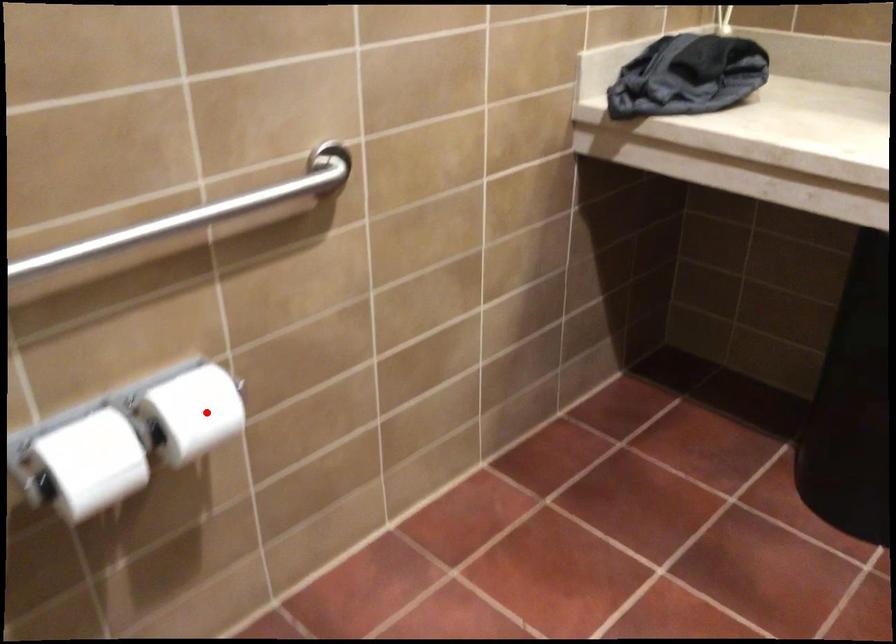
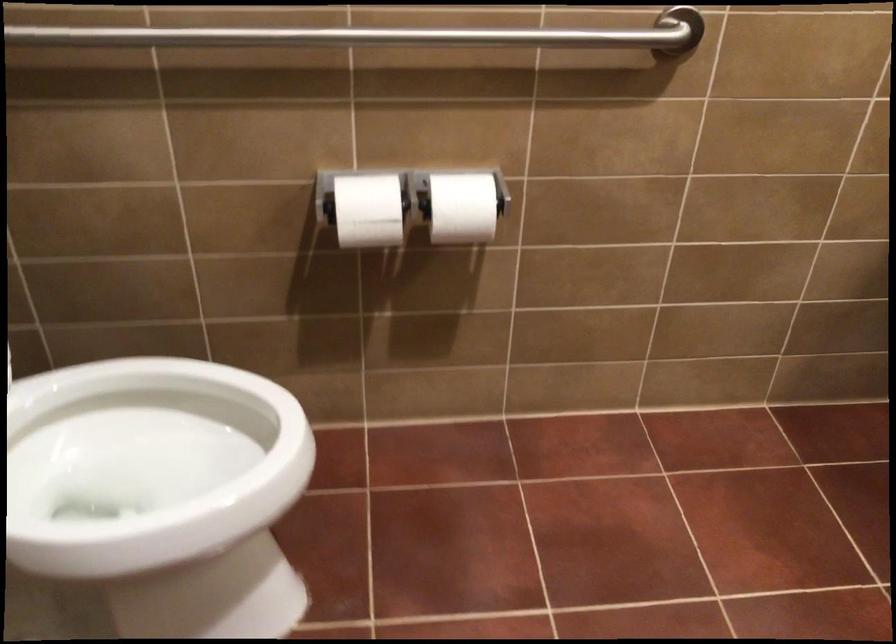
Find the pixel in the second image that matches the highlighted location in the first image.

(462, 207)